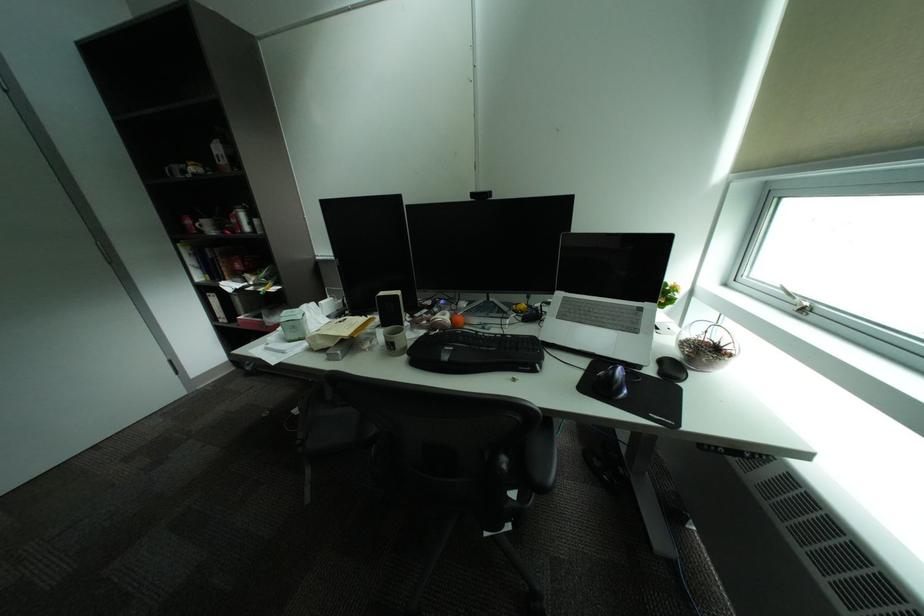
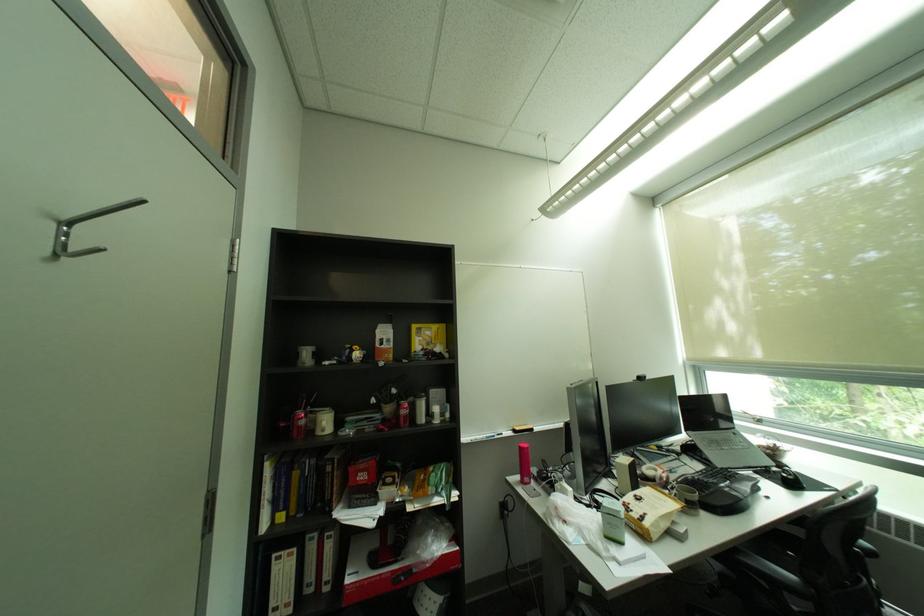
Locate, in the second image, the point that corresponds to [516,336] in the first image.

(712, 472)